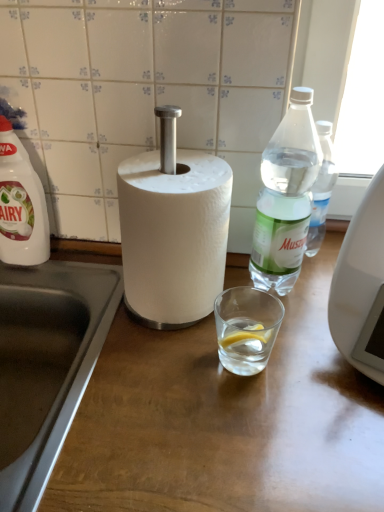
Question: Should I look upward or downward to see wooden at center?

Choices:
 (A) down
 (B) up

Answer: (A)

Question: From the image's perspective, would you say white plastic bottle at left, marked as the second bottle in a right-to-left arrangement, is shown under wooden at center?

Choices:
 (A) yes
 (B) no

Answer: (B)

Question: Considering the relative positions of white plastic bottle at left, the first bottle viewed from the left, and wooden at center in the image provided, is white plastic bottle at left, the first bottle viewed from the left, to the right of wooden at center from the viewer's perspective?

Choices:
 (A) no
 (B) yes

Answer: (A)

Question: Is white plastic bottle at left, the first bottle viewed from the left, positioned with its back to wooden at center?

Choices:
 (A) yes
 (B) no

Answer: (B)

Question: Is white plastic bottle at left, marked as the second bottle in a right-to-left arrangement, closer to the viewer compared to wooden at center?

Choices:
 (A) yes
 (B) no

Answer: (B)

Question: Is white plastic bottle at left, the first bottle viewed from the left, surrounding wooden at center?

Choices:
 (A) no
 (B) yes

Answer: (A)

Question: Is white plastic bottle at left, marked as the second bottle in a right-to-left arrangement, not close to wooden at center?

Choices:
 (A) no
 (B) yes

Answer: (A)

Question: Is white plastic bottle at left, the first bottle viewed from the left, wider than clear plastic bottle at right, marked as the first bottle in a right-to-left arrangement?

Choices:
 (A) no
 (B) yes

Answer: (A)

Question: Considering the relative positions of white plastic bottle at left, the first bottle viewed from the left, and clear plastic bottle at right, the 2th bottle viewed from the left, in the image provided, is white plastic bottle at left, the first bottle viewed from the left, to the right of clear plastic bottle at right, the 2th bottle viewed from the left, from the viewer's perspective?

Choices:
 (A) no
 (B) yes

Answer: (A)

Question: Can you confirm if white plastic bottle at left, marked as the second bottle in a right-to-left arrangement, is thinner than clear plastic bottle at right, the 2th bottle viewed from the left?

Choices:
 (A) yes
 (B) no

Answer: (A)

Question: Is white plastic bottle at left, marked as the second bottle in a right-to-left arrangement, located outside clear plastic bottle at right, marked as the first bottle in a right-to-left arrangement?

Choices:
 (A) yes
 (B) no

Answer: (A)

Question: Can you confirm if white plastic bottle at left, marked as the second bottle in a right-to-left arrangement, is bigger than clear plastic bottle at right, marked as the first bottle in a right-to-left arrangement?

Choices:
 (A) yes
 (B) no

Answer: (B)

Question: Is white plastic bottle at left, marked as the second bottle in a right-to-left arrangement, shorter than clear plastic bottle at right, the 2th bottle viewed from the left?

Choices:
 (A) no
 (B) yes

Answer: (A)

Question: From a real-world perspective, is wooden at center on clear plastic bottle at right, marked as the first bottle in a right-to-left arrangement?

Choices:
 (A) yes
 (B) no

Answer: (B)